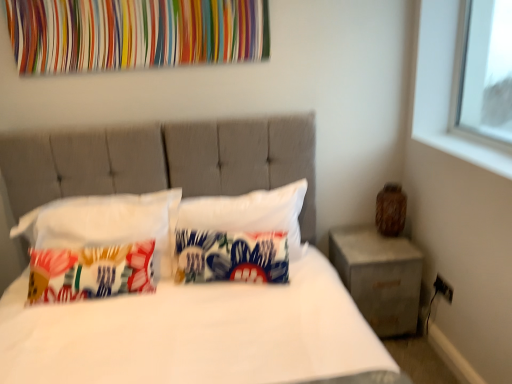
Question: Can you confirm if printed fabric pillow at center, the 2th pillow positioned from the right, is smaller than concrete/rough concrete nightstand at right?

Choices:
 (A) no
 (B) yes

Answer: (B)

Question: Considering the relative positions of printed fabric pillow at center, the 2th pillow positioned from the right, and concrete/rough concrete nightstand at right in the image provided, is printed fabric pillow at center, the 2th pillow positioned from the right, to the right of concrete/rough concrete nightstand at right from the viewer's perspective?

Choices:
 (A) no
 (B) yes

Answer: (A)

Question: Is printed fabric pillow at center, the 2th pillow positioned from the right, surrounding concrete/rough concrete nightstand at right?

Choices:
 (A) yes
 (B) no

Answer: (B)

Question: From the image's perspective, would you say printed fabric pillow at center, marked as the 2th pillow in a left-to-right arrangement, is positioned over concrete/rough concrete nightstand at right?

Choices:
 (A) yes
 (B) no

Answer: (A)

Question: Is printed fabric pillow at center, marked as the 2th pillow in a left-to-right arrangement, positioned far away from concrete/rough concrete nightstand at right?

Choices:
 (A) yes
 (B) no

Answer: (B)

Question: Is printed fabric pillow at center, the 2th pillow positioned from the right, thinner than concrete/rough concrete nightstand at right?

Choices:
 (A) yes
 (B) no

Answer: (A)

Question: From a real-world perspective, does multicolored fabric at upper center stand above white fabric pillow at center, the third pillow when ordered from left to right?

Choices:
 (A) yes
 (B) no

Answer: (A)

Question: Is multicolored fabric at upper center behind white fabric pillow at center, the 1th pillow in the right-to-left sequence?

Choices:
 (A) yes
 (B) no

Answer: (B)

Question: Is multicolored fabric at upper center taller than white fabric pillow at center, the third pillow when ordered from left to right?

Choices:
 (A) no
 (B) yes

Answer: (A)

Question: Considering the relative positions of multicolored fabric at upper center and white fabric pillow at center, the 1th pillow in the right-to-left sequence, in the image provided, is multicolored fabric at upper center to the left of white fabric pillow at center, the 1th pillow in the right-to-left sequence, from the viewer's perspective?

Choices:
 (A) no
 (B) yes

Answer: (B)

Question: Considering the relative sizes of multicolored fabric at upper center and white fabric pillow at center, the third pillow when ordered from left to right, in the image provided, is multicolored fabric at upper center smaller than white fabric pillow at center, the third pillow when ordered from left to right,?

Choices:
 (A) no
 (B) yes

Answer: (B)

Question: Could you tell me if multicolored fabric at upper center is turned towards white fabric pillow at center, the 1th pillow in the right-to-left sequence?

Choices:
 (A) no
 (B) yes

Answer: (A)

Question: Is white fabric bed at center not inside concrete/rough concrete nightstand at right?

Choices:
 (A) no
 (B) yes

Answer: (B)